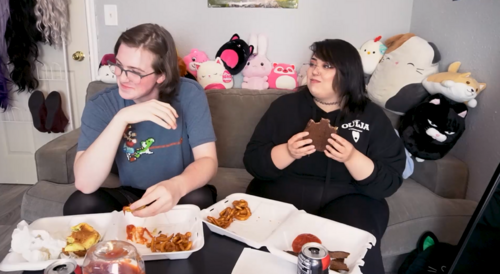
Where is `light switch`? The width and height of the screenshot is (500, 274). light switch is located at coordinates (116, 12).